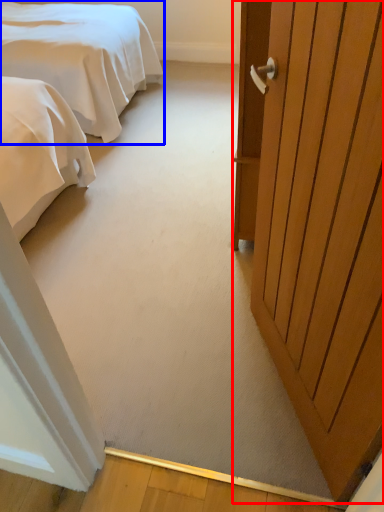
Question: Which object is closer to the camera taking this photo, door (highlighted by a red box) or bed (highlighted by a blue box)?

Choices:
 (A) door
 (B) bed

Answer: (A)